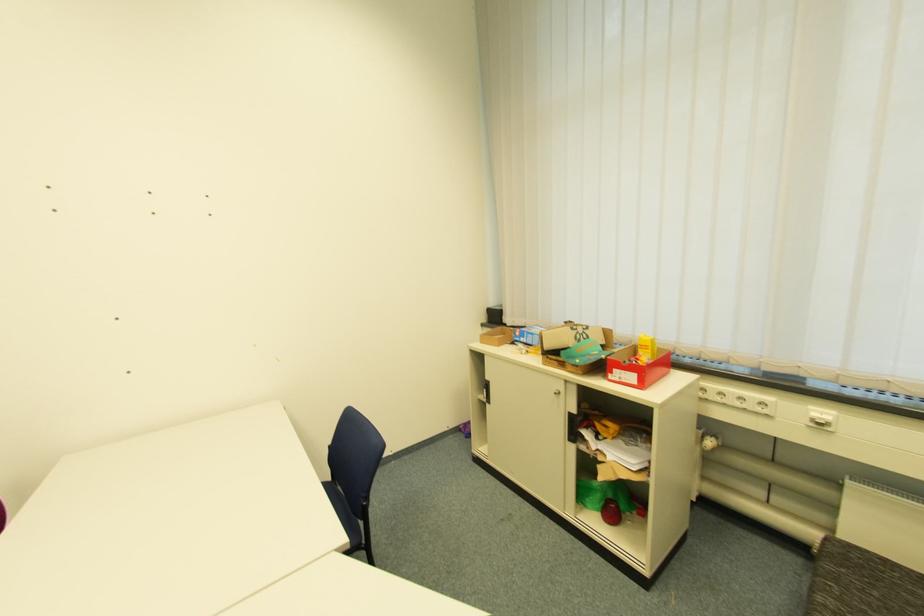
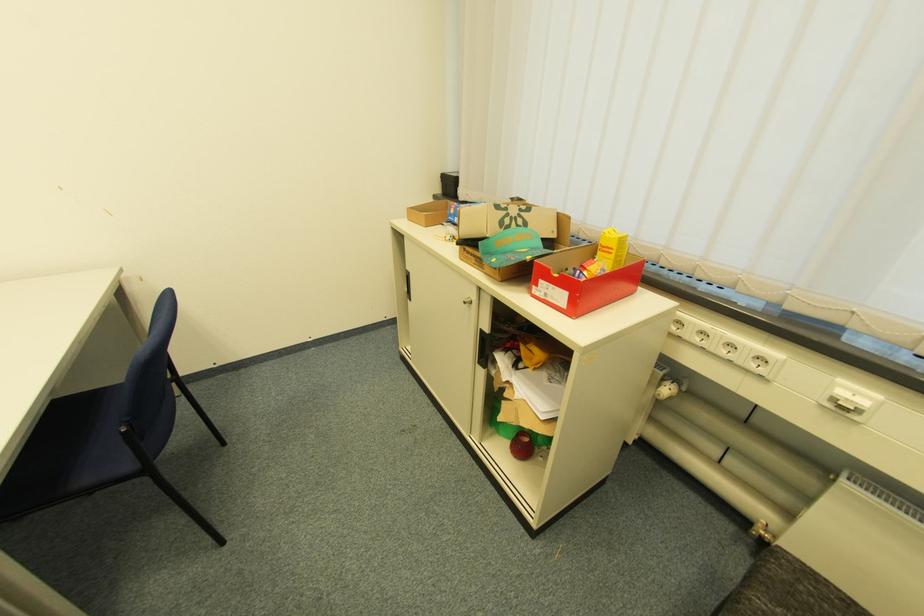
In a continuous first-person perspective shot, in which direction is the camera moving?

The cameraman walked toward right, forward.